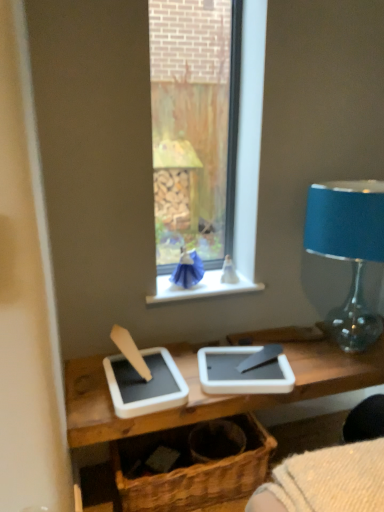
Question: Considering the positions of point (261, 283) and point (148, 502), is point (261, 283) closer or farther from the camera than point (148, 502)?

Choices:
 (A) closer
 (B) farther

Answer: (B)

Question: Considering the positions of white plastic window sill at center and brown woven basket at center in the image, is white plastic window sill at center taller or shorter than brown woven basket at center?

Choices:
 (A) tall
 (B) short

Answer: (B)

Question: Considering the real-world distances, which object is closest to the brown woven basket at center?

Choices:
 (A) blue glass lampshade at right
 (B) white plastic window sill at center

Answer: (B)

Question: Which of these objects is positioned farthest from the white plastic window sill at center?

Choices:
 (A) brown woven basket at center
 (B) blue glass lampshade at right

Answer: (A)